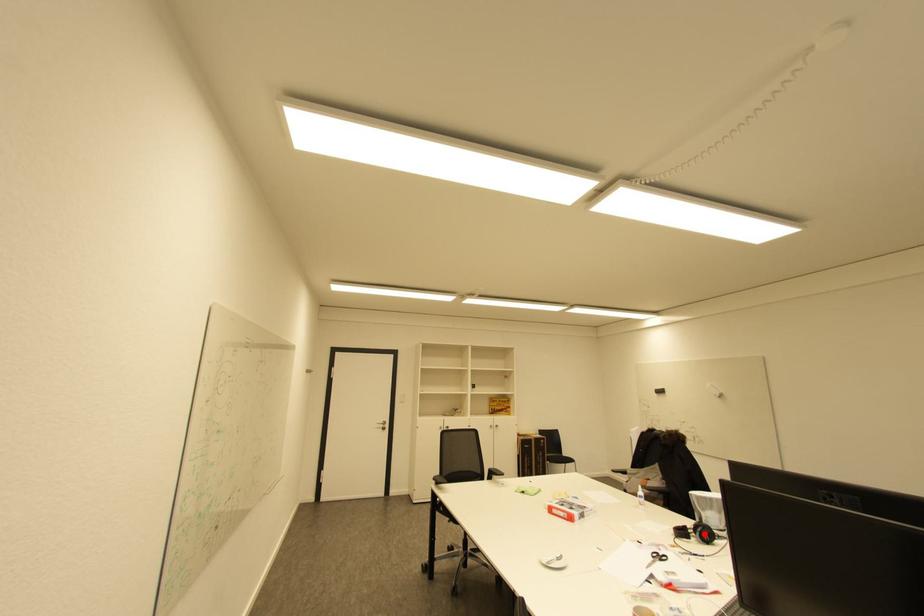
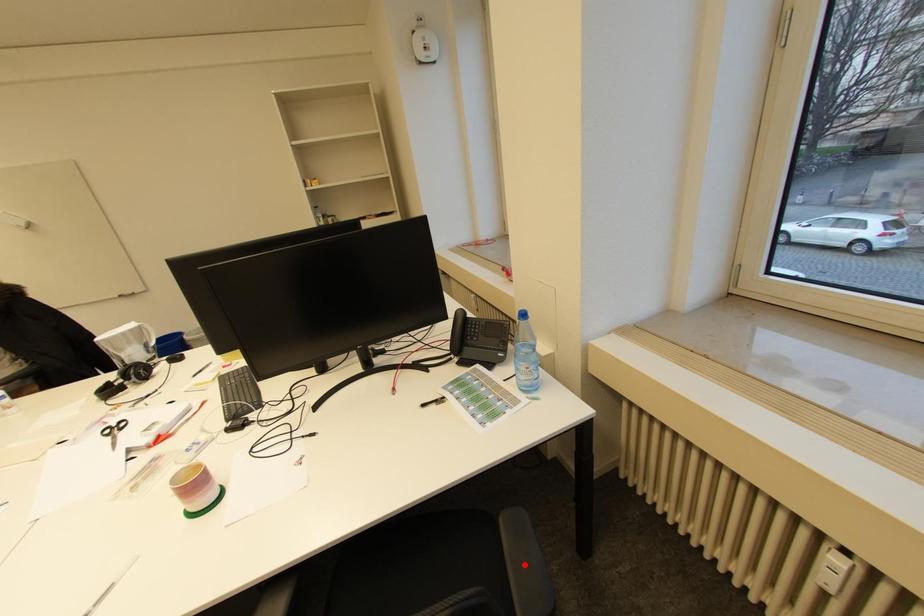
I am providing you with two images of the same scene from different viewpoints. A red point is marked on the first image and another point is marked on the second image. Do the highlighted points in image1 and image2 indicate the same real-world spot?

No